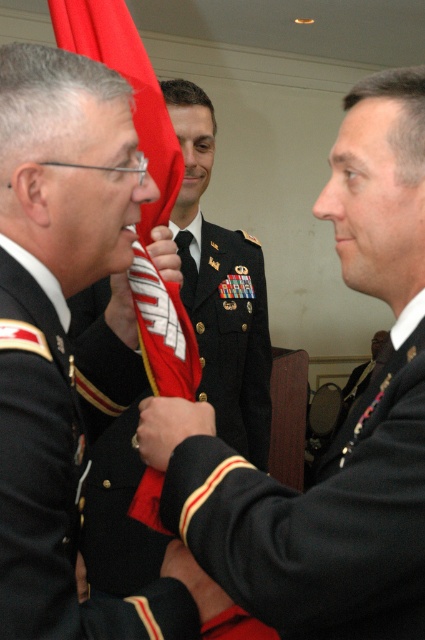
You are a photographer at this military ceremony. You need to capture a photo where both the red fabric flag at center and the white fabric at center are clearly visible. Considering their sizes, which fabric should you focus on to ensure it doesn

The red fabric flag at center is much taller than the white fabric at center, so you should focus on capturing the red fabric flag at center first to ensure it is properly framed and visible in the photo.

You are a photographer at the ceremony and want to capture a clear photo of both the shiny black uniform at center and the black leather hand at center. Since the camera has a fixed focus, you can only focus on one object. Which object should you focus on to ensure the other is still in focus?

The shiny black uniform at center is bigger than the black leather hand at center, so focusing on the shiny black uniform at center will keep the black leather hand at center in focus as it is smaller and closer to the same focal plane.

You are a military photographer tasked with capturing the flag exchange ceremony. You need to ensure both the red fabric flag at center and the white fabric at center are clearly visible in your photo. Which flag should you focus on first to ensure it is in frame, considering their sizes?

The red fabric flag at center is bigger than the white fabric at center, so you should focus on capturing the red fabric flag at center first as its larger size ensures it will be more prominently visible in the frame.